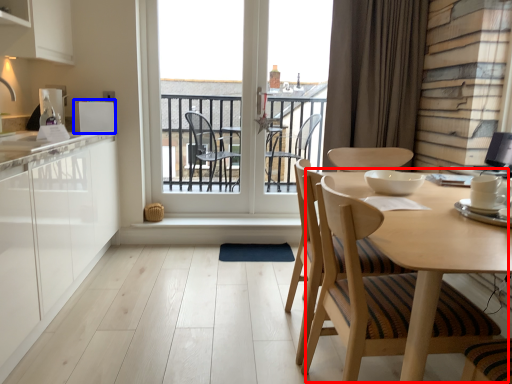
Question: Among these objects, which one is nearest to the camera, round table (highlighted by a red box) or appliance (highlighted by a blue box)?

Choices:
 (A) round table
 (B) appliance

Answer: (A)